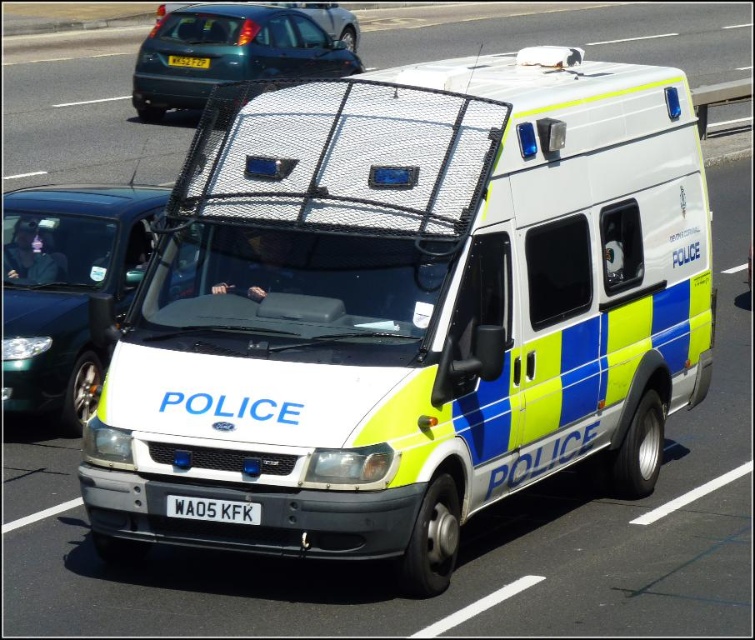
You are standing on the sidewalk and see the yellow reflective van at center approaching you. If the van is moving at 10 km per hour, how long will it take for the van to reach you?

The yellow reflective van at center is 8.36 meters away from you. At a speed of 10 km per hour, it will take approximately 30 seconds for the van to reach you.

You are a delivery person who needs to photograph the license plate of the white glossy van at center for a report. You have a camera that can focus on objects within 20 inches. Can you take a clear photo of the white plastic license plate at center without moving closer?

The white glossy van at center is 22.61 inches from the white plastic license plate at center. Since the camera requires objects to be within 20 inches for clear focus, the distance is too great. You need to move closer to ensure the license plate is within the 20 inch range for a clear photo.

You are a driver looking at the road ahead. There is a point marked at coordinates (408, 308). Based on the scene description, what object is this point located on?

The point marked at coordinates (408, 308) is located on the white glossy van at center.